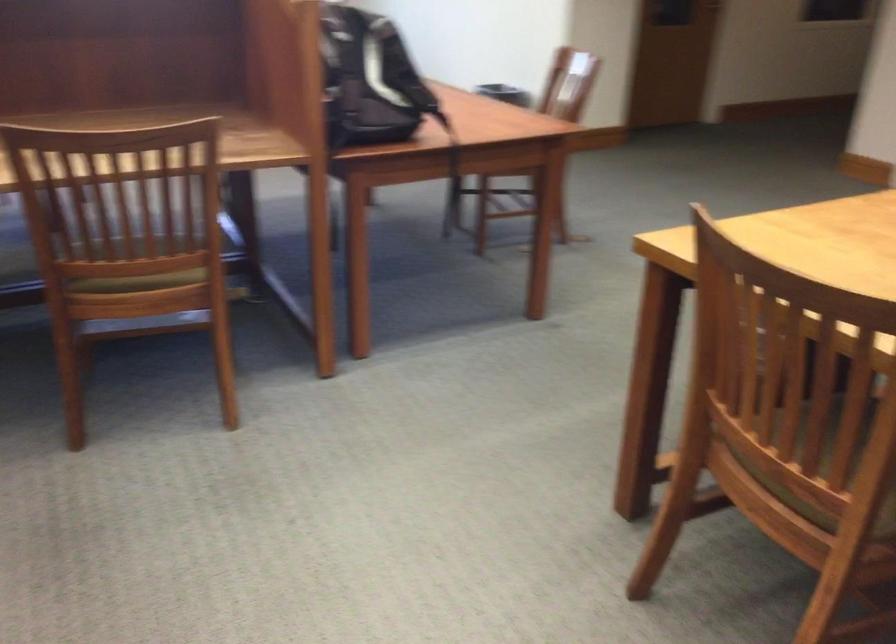
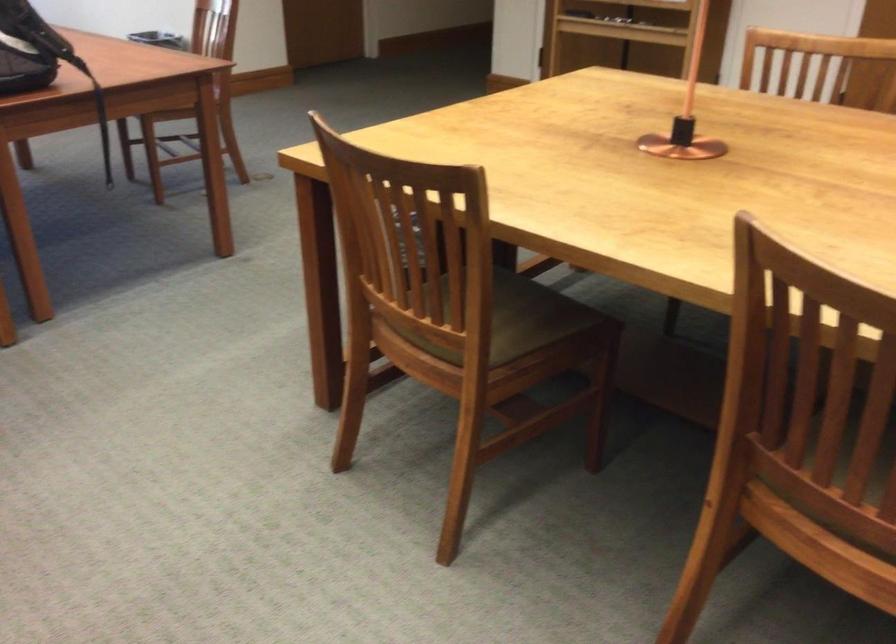
In a continuous first-person perspective shot, in which direction is the camera moving?

The cameraman moved toward right, backward.